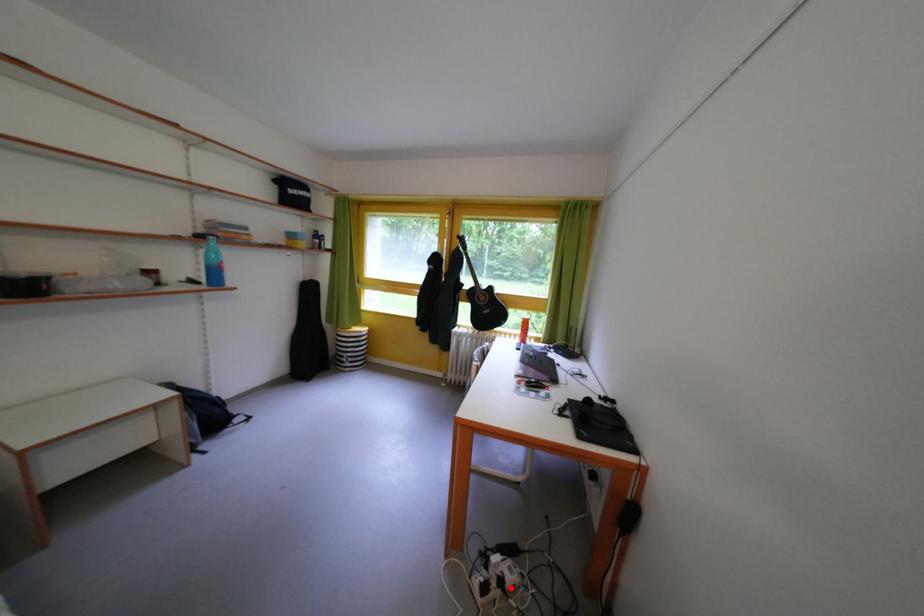
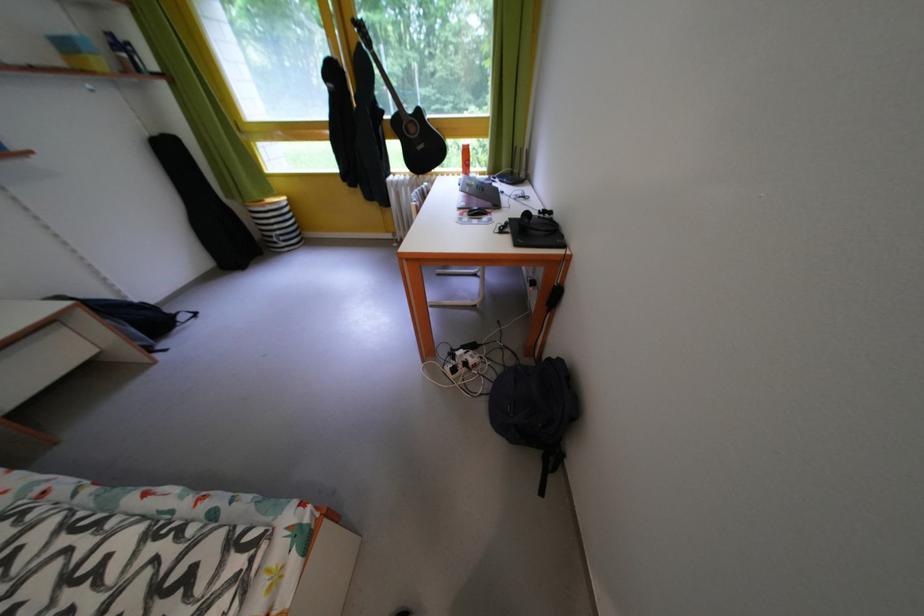
The point at the highlighted location is marked in the first image. Where is the corresponding point in the second image?

(476, 370)